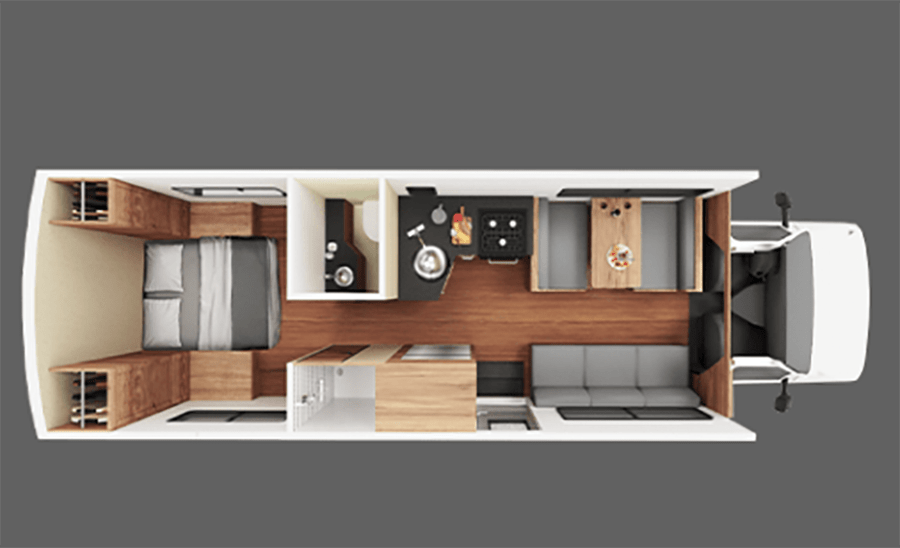
This screenshot has width=900, height=548. I want to click on couch, so click(612, 362).